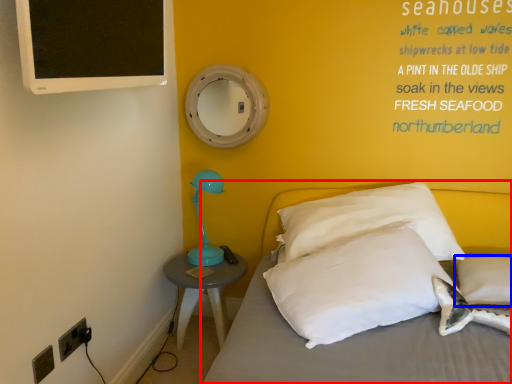
Question: Which object appears closest to the camera in this image, bed (highlighted by a red box) or pillow (highlighted by a blue box)?

Choices:
 (A) bed
 (B) pillow

Answer: (A)